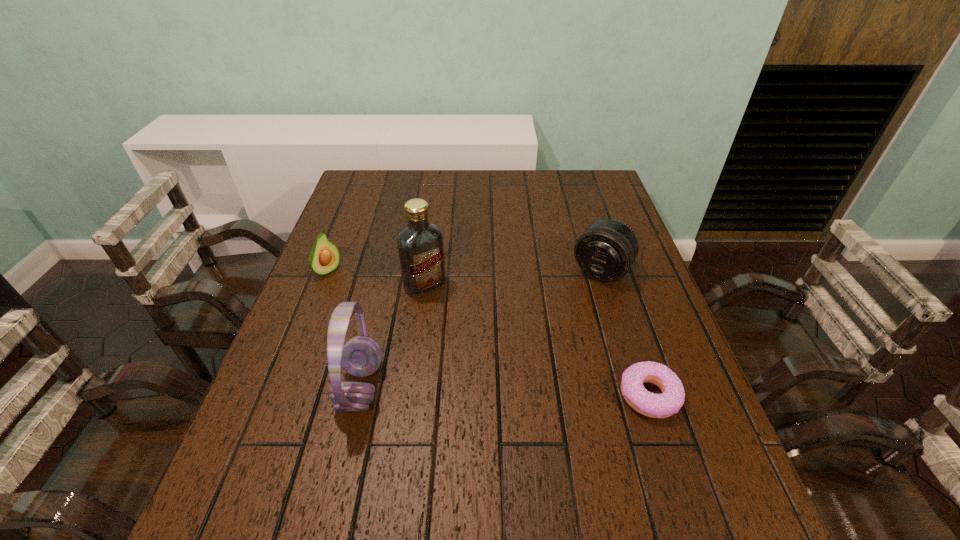
Locate an element on the screen. This screenshot has width=960, height=540. vacant area situated 0.080m on the headband and ear cups of the second object from left to right is located at coordinates pyautogui.click(x=302, y=387).

Identify the location of vacant region located on the left of the doughnut. Image resolution: width=960 pixels, height=540 pixels. (595, 395).

You are a GUI agent. You are given a task and a screenshot of the screen. Output one action in this format:
    pyautogui.click(x=<x>, y=<y>)
    Task: Click on the free region located on the front-facing side of the telephoto lens
    The image size is (960, 540).
    Given the screenshot: What is the action you would take?
    (x=572, y=312)

Find the location of a particular element. vacant region located on the front-facing side of the telephoto lens is located at coordinates (562, 327).

Where is `vacant space located on the front-facing side of the telephoto lens`? vacant space located on the front-facing side of the telephoto lens is located at coordinates pyautogui.click(x=577, y=305).

I want to click on free location located on the cut side of the leftmost object, so click(x=357, y=295).

Image resolution: width=960 pixels, height=540 pixels. Find the location of `blank space located on the cut side of the leftmost object`. blank space located on the cut side of the leftmost object is located at coordinates (374, 308).

Where is `blank space located 0.130m on the cut side of the leftmost object`? This screenshot has width=960, height=540. blank space located 0.130m on the cut side of the leftmost object is located at coordinates (365, 300).

At what (x,y) coordinates should I click in order to perform the action: click on vacant space located on the front-facing side of the third object from left to right. Please return your answer as a coordinate pair (x, y). The width and height of the screenshot is (960, 540). Looking at the image, I should click on (472, 347).

Find the location of a particular element. free space located on the front-facing side of the third object from left to right is located at coordinates (521, 414).